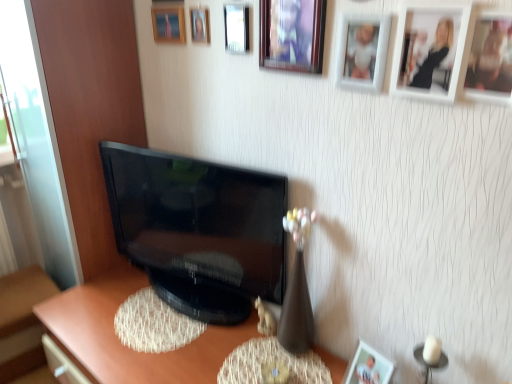
Question: Is matte white picture frame at lower right, the 1th picture frame positioned from the bottom, in front of or behind black glossy television at center in the image?

Choices:
 (A) front
 (B) behind

Answer: (A)

Question: Considering the positions of matte white picture frame at lower right, marked as the 8th picture frame in a top-to-bottom arrangement, and black glossy television at center in the image, is matte white picture frame at lower right, marked as the 8th picture frame in a top-to-bottom arrangement, taller or shorter than black glossy television at center?

Choices:
 (A) tall
 (B) short

Answer: (B)

Question: Which object is the farthest from the matte white picture frame at lower right, marked as the 8th picture frame in a top-to-bottom arrangement?

Choices:
 (A) matte brown desk at center
 (B) matte glass picture frame at upper center, the 6th picture frame when ordered from bottom to top
 (C) white matte picture frame at upper right, which ranks as the second picture frame in right-to-left order
 (D) wooden picture frame at upper center, the 4th picture frame when ordered from top to bottom
 (E) black glossy television at center

Answer: (B)

Question: Estimate the real-world distances between objects in this image. Which object is farther from the black glossy television at center?

Choices:
 (A) white matte picture frame at upper right, which appears as the sixth picture frame when viewed from the top
 (B) matte brown desk at center
 (C) matte wooden picture frame at upper center, the 7th picture frame positioned from the right
 (D) matte white picture frame at lower right, marked as the 8th picture frame in a top-to-bottom arrangement
 (E) white plastic dog at lower center

Answer: (A)